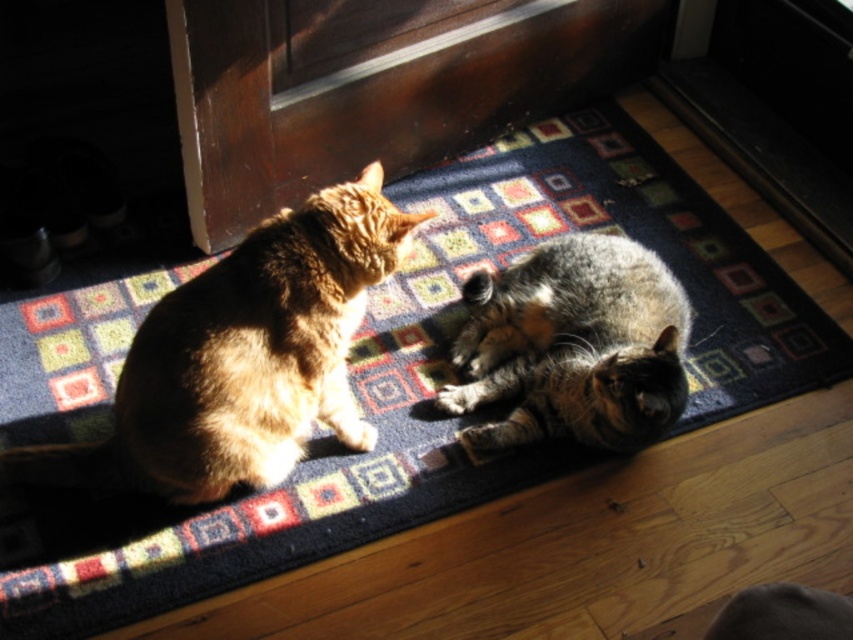
You are a small delivery robot that is 30 cm wide. You need to deliver a package through the wooden screen door at upper center. However, there is a tabby fur cat at left blocking the path. Can you pass through the door without moving the cat?

The wooden screen door at upper center might be wider than the tabby fur cat at left. If the door is indeed wider, the robot can pass through the door as long as there is enough space on either side of the cat. However, if the door is not wider, the robot may need to wait for the cat to move.

You are a delivery person holding a package and standing at the entrance of the house. You need to place the package on the floor near the wooden screen door at upper center. Where should you place the package relative to the cats?

The wooden screen door at upper center is located at point (370, 86). Since the cats are on the rug near the doorway, you should place the package on the floor near the wooden screen door at upper center but away from the cats to avoid disturbing them.